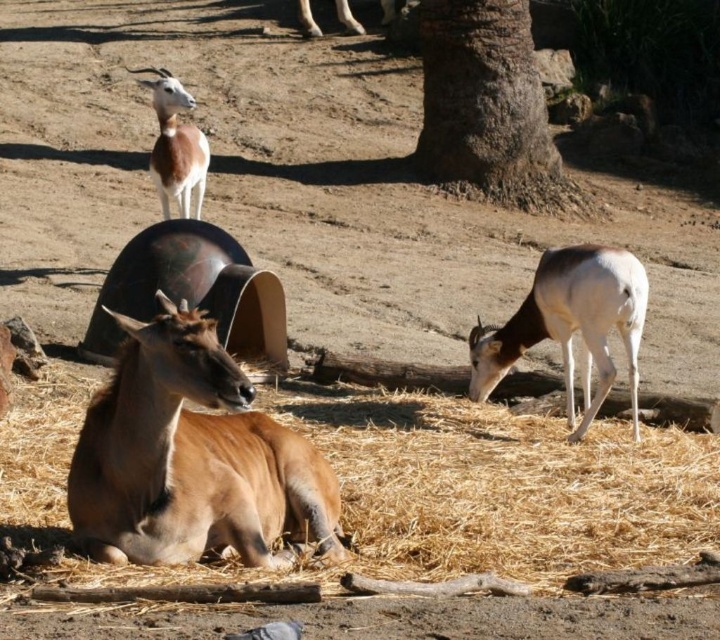
Question: Is brown matte/deer at center further to the viewer compared to white glossy antelope at lower right?

Choices:
 (A) no
 (B) yes

Answer: (A)

Question: In this image, where is brown dry hay at lower center located relative to light brown fur antelope at upper left?

Choices:
 (A) above
 (B) below

Answer: (B)

Question: Which of the following is the closest to the observer?

Choices:
 (A) (570, 182)
 (B) (595, 304)
 (C) (312, 506)

Answer: (C)

Question: Is brown matte/deer at center further to the viewer compared to brown rough bark tree at upper center?

Choices:
 (A) yes
 (B) no

Answer: (B)

Question: Which object is closer to the camera taking this photo?

Choices:
 (A) brown rough bark tree at upper center
 (B) brown matte/deer at center

Answer: (B)

Question: Which point is farther to the camera?

Choices:
 (A) light brown fur antelope at upper left
 (B) white glossy antelope at lower right

Answer: (A)